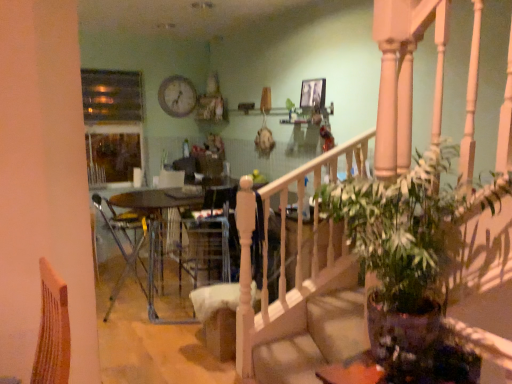
Question: Considering the relative sizes of wooden clock at upper center and green glossy houseplant at lower right in the image provided, is wooden clock at upper center smaller than green glossy houseplant at lower right?

Choices:
 (A) no
 (B) yes

Answer: (B)

Question: Is wooden clock at upper center shorter than green glossy houseplant at lower right?

Choices:
 (A) no
 (B) yes

Answer: (B)

Question: Could you tell me if wooden clock at upper center is facing green glossy houseplant at lower right?

Choices:
 (A) no
 (B) yes

Answer: (B)

Question: From the image's perspective, is wooden clock at upper center on green glossy houseplant at lower right?

Choices:
 (A) no
 (B) yes

Answer: (B)

Question: From a real-world perspective, is wooden clock at upper center positioned under green glossy houseplant at lower right based on gravity?

Choices:
 (A) yes
 (B) no

Answer: (B)

Question: Considering the relative sizes of wooden clock at upper center and green glossy houseplant at lower right in the image provided, is wooden clock at upper center taller than green glossy houseplant at lower right?

Choices:
 (A) yes
 (B) no

Answer: (B)

Question: Is velvet beige armchair at center smaller than wooden clock at upper center?

Choices:
 (A) no
 (B) yes

Answer: (A)

Question: Does velvet beige armchair at center lie in front of wooden clock at upper center?

Choices:
 (A) no
 (B) yes

Answer: (B)

Question: From the image's perspective, would you say velvet beige armchair at center is shown under wooden clock at upper center?

Choices:
 (A) no
 (B) yes

Answer: (B)

Question: Is velvet beige armchair at center not near wooden clock at upper center?

Choices:
 (A) yes
 (B) no

Answer: (A)

Question: Does velvet beige armchair at center contain wooden clock at upper center?

Choices:
 (A) no
 (B) yes

Answer: (A)

Question: From a real-world perspective, is velvet beige armchair at center positioned under wooden clock at upper center based on gravity?

Choices:
 (A) no
 (B) yes

Answer: (B)

Question: Considering the relative sizes of metallic silver chair at center and green glossy houseplant at lower right in the image provided, is metallic silver chair at center wider than green glossy houseplant at lower right?

Choices:
 (A) yes
 (B) no

Answer: (A)